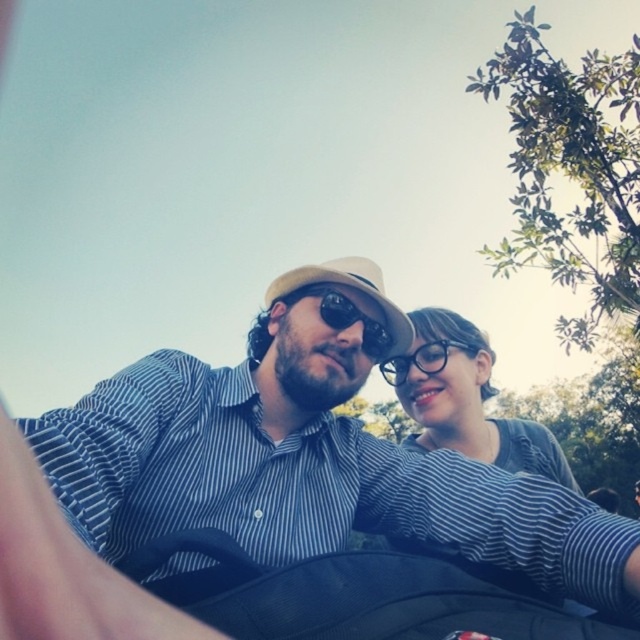
Does point (68, 417) come in front of point (436, 349)?

Yes, it is in front of point (436, 349).

Can you confirm if blue striped shirt at center is shorter than transparent plastic glasses at center?

Incorrect, blue striped shirt at center's height does not fall short of transparent plastic glasses at center's.

Between point (353, 358) and point (451, 342), which one is positioned behind?

The point (451, 342) is more distant.

Identify the location of blue striped shirt at center. This screenshot has width=640, height=640. (307, 460).

From the picture: Between blue striped shirt at center and matte gray shirt at center, which one has less height?

matte gray shirt at center

Does blue striped shirt at center have a greater height compared to matte gray shirt at center?

Yes.

In order to click on blue striped shirt at center in this screenshot , I will do `click(307, 460)`.

In order to click on blue striped shirt at center in this screenshot , I will do [x=307, y=460].

Does sunglasses at center come in front of transparent plastic glasses at center?

That is True.

Is sunglasses at center taller than transparent plastic glasses at center?

Correct, sunglasses at center is much taller as transparent plastic glasses at center.

Between point (326, 314) and point (392, 368), which one is positioned behind?

Point (392, 368)

This screenshot has height=640, width=640. Identify the location of sunglasses at center. (346, 317).